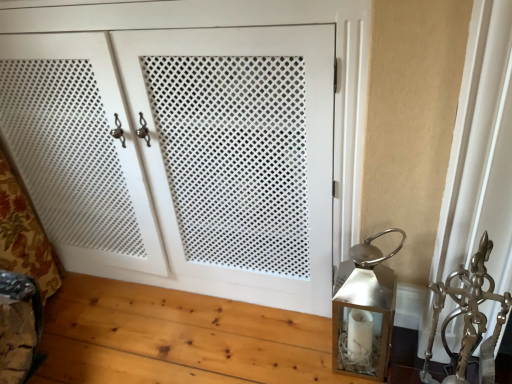
Question: From the image's perspective, relative to metallic silver sculpture at right, is white matte cabinet doors at center above or below?

Choices:
 (A) above
 (B) below

Answer: (A)

Question: Based on their positions, is white matte cabinet doors at center located to the left or right of metallic silver sculpture at right?

Choices:
 (A) left
 (B) right

Answer: (A)

Question: Which is farther from the metallic silver sculpture at right?

Choices:
 (A) silver metallic lantern at right
 (B) white matte cabinet doors at center

Answer: (B)

Question: Which of these objects is positioned closest to the white matte cabinet doors at center?

Choices:
 (A) silver metallic lantern at right
 (B) metallic silver sculpture at right

Answer: (A)